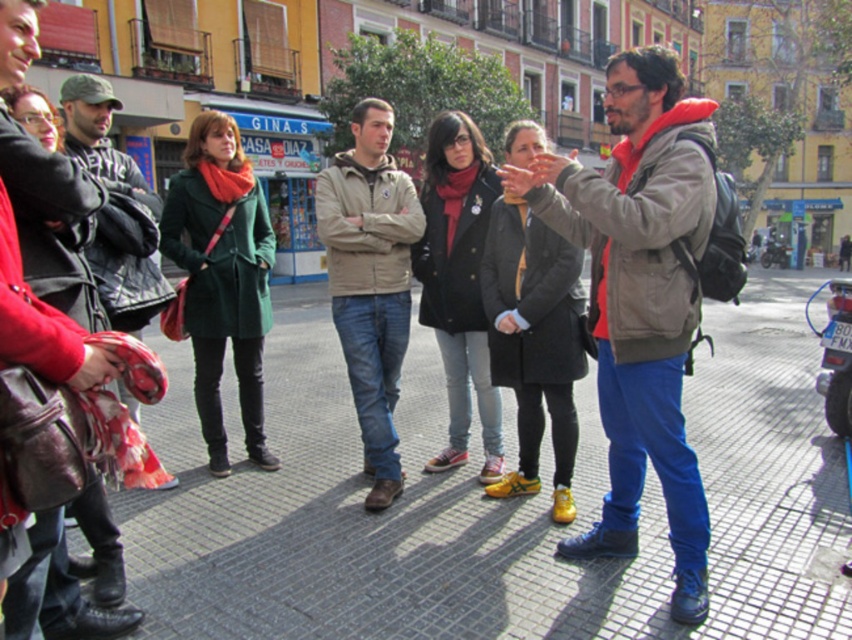
You are standing in the middle of the street and see two points marked in the scene. Which point is closer to you, point [753,400] or point [580,221]?

Point [753,400] is further to the viewer than point [580,221], so the closer point is point [580,221].

You are a photographer standing at point (x=640, y=298) in the image. You want to capture a photo of the matte gray jacket at center without any obstructions. Is there enough space around the matte gray jacket at center to frame it properly?

The matte gray jacket at center is located at point (x=640, y=298), so yes, there is enough space around it to frame it properly without obstructions.